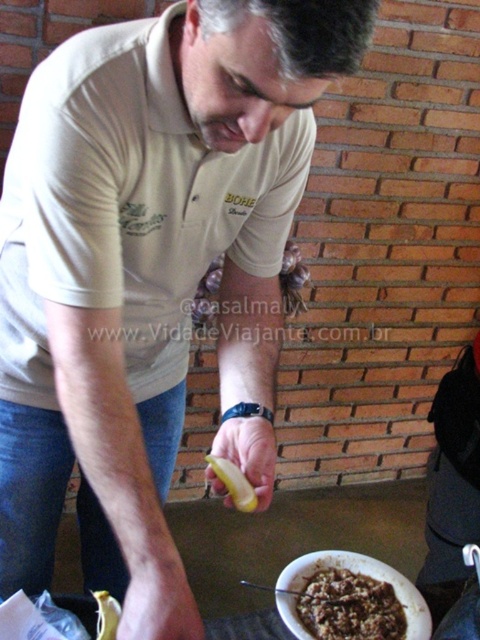
Is yellow matte banana at center thinner than yellow matte banana at lower center?

Correct, yellow matte banana at center's width is less than yellow matte banana at lower center's.

Does yellow matte banana at center have a lesser height compared to yellow matte banana at lower center?

Indeed, yellow matte banana at center has a lesser height compared to yellow matte banana at lower center.

Measure the distance between yellow matte banana at center and camera.

78.86 centimeters

In order to click on yellow matte banana at center in this screenshot , I will do `click(233, 483)`.

Measure the distance between brown matte food at lower center and yellow matte banana at center.

brown matte food at lower center and yellow matte banana at center are 8.91 inches apart.

What do you see at coordinates (348, 604) in the screenshot?
I see `brown matte food at lower center` at bounding box center [348, 604].

This screenshot has width=480, height=640. In order to click on brown matte food at lower center in this screenshot , I will do `click(348, 604)`.

Locate an element on the screen. The image size is (480, 640). brown matte food at lower center is located at coordinates (348, 604).

Who is higher up, brown matte food at lower center or yellow matte banana at lower center?

yellow matte banana at lower center is above.

Who is more forward, (315, 627) or (111, 630)?

Point (111, 630)

At what (x,y) coordinates should I click in order to perform the action: click on brown matte food at lower center. Please return your answer as a coordinate pair (x, y). The height and width of the screenshot is (640, 480). Looking at the image, I should click on (348, 604).